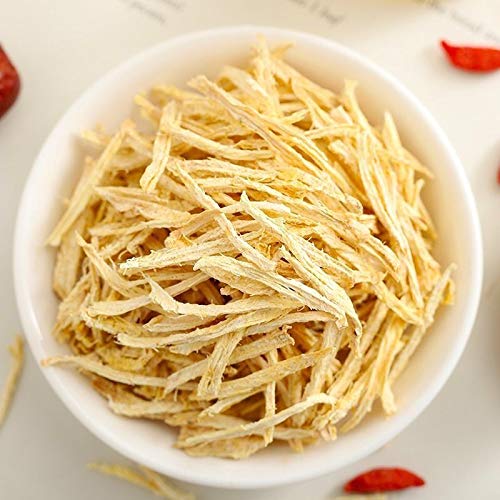
This screenshot has width=500, height=500. Identify the location of bowl. (465, 242).